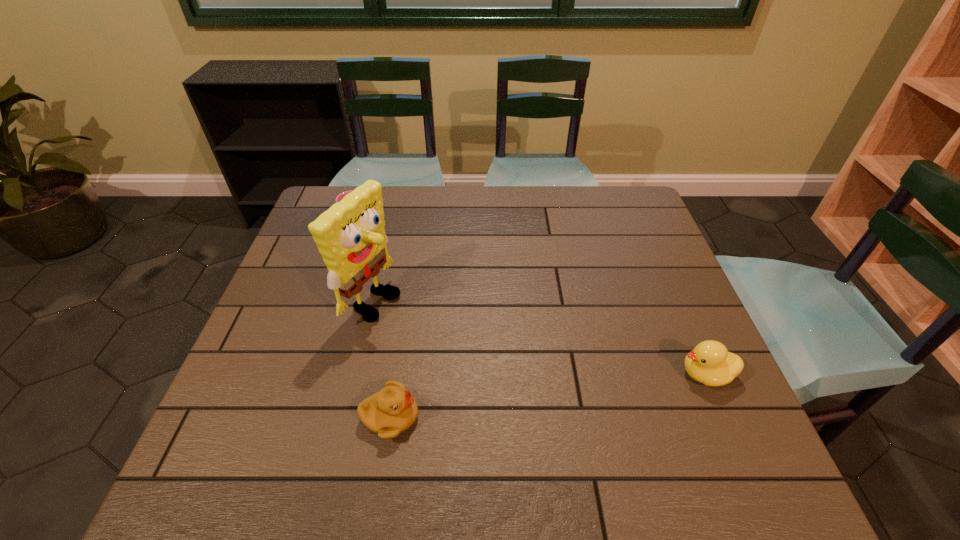
You are a GUI agent. You are given a task and a screenshot of the screen. Output one action in this format:
    pyautogui.click(x=<x>, y=<y>)
    Task: Click on the empty space that is in between the left duckling and the rightmost object
    
    Given the screenshot: What is the action you would take?
    pyautogui.click(x=548, y=396)

Locate an element on the screen. This screenshot has width=960, height=540. vacant point located between the tallest object and the left duckling is located at coordinates (382, 359).

Image resolution: width=960 pixels, height=540 pixels. I want to click on vacant area between the sponge and the right duckling, so click(540, 338).

Locate an element on the screen. This screenshot has width=960, height=540. object that stands as the closest to the rightmost object is located at coordinates (391, 411).

Choose which object is the nearest neighbor to the third nearest object. Please provide its 2D coordinates. Your answer should be formatted as a tuple, i.e. [(x, y)], where the tuple contains the x and y coordinates of a point satisfying the conditions above.

[(391, 411)]

This screenshot has height=540, width=960. I want to click on free space in the image that satisfies the following two spatial constraints: 1. on the front side of the right duckling; 2. on the beak of the tallest object, so (356, 374).

The height and width of the screenshot is (540, 960). Find the location of `vacant space that satisfies the following two spatial constraints: 1. on the front side of the second farthest object; 2. on the beak of the rightmost object`. vacant space that satisfies the following two spatial constraints: 1. on the front side of the second farthest object; 2. on the beak of the rightmost object is located at coordinates (356, 374).

This screenshot has width=960, height=540. What are the coordinates of `vacant space that satisfies the following two spatial constraints: 1. on the front side of the rightmost object; 2. on the beak of the third nearest object` in the screenshot? It's located at (356, 374).

Image resolution: width=960 pixels, height=540 pixels. I want to click on vacant area that satisfies the following two spatial constraints: 1. on the front side of the shortest object; 2. on the beak of the rightmost object, so click(x=301, y=374).